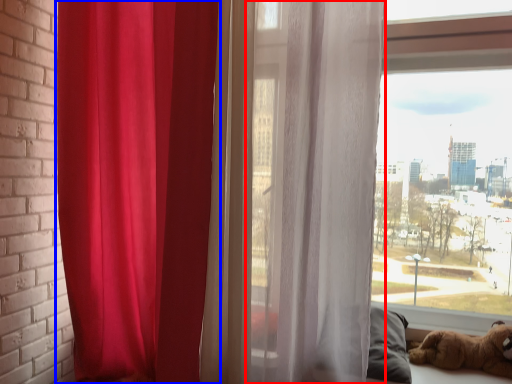
Question: Which object appears closest to the camera in this image, curtain (highlighted by a red box) or curtain (highlighted by a blue box)?

Choices:
 (A) curtain
 (B) curtain

Answer: (A)